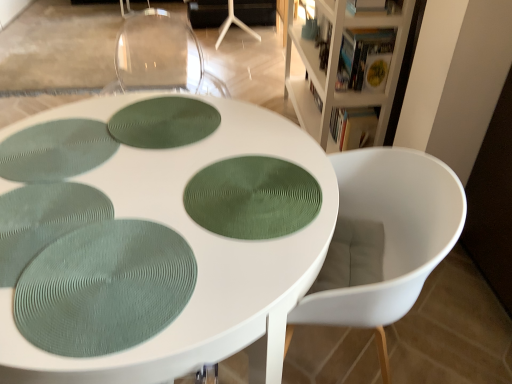
Question: Do you think white wood bookcase at upper right is within green textured placemat at center, positioned as the second oval in top-to-bottom order, or outside of it?

Choices:
 (A) outside
 (B) inside

Answer: (A)

Question: Considering the positions of white wood bookcase at upper right and green textured placemat at center, acting as the second oval starting from the back, in the image, is white wood bookcase at upper right bigger or smaller than green textured placemat at center, acting as the second oval starting from the back,?

Choices:
 (A) small
 (B) big

Answer: (B)

Question: Estimate the real-world distances between objects in this image. Which object is farther from the white matte table at center?

Choices:
 (A) green textured placemat at center, acting as the second oval starting from the back
 (B) white plastic chair at lower right
 (C) green textured placemat at center, the 3th oval from the front
 (D) white wood bookcase at upper right
 (E) green textured placemat at lower left, marked as the 3th oval in a back-to-front arrangement

Answer: (D)

Question: Which object is the farthest from the white plastic chair at lower right?

Choices:
 (A) green textured placemat at center, positioned as the second oval in top-to-bottom order
 (B) green textured placemat at center, which ranks as the first oval in top-to-bottom order
 (C) white matte table at center
 (D) green textured placemat at lower left, the first oval from the bottom
 (E) white wood bookcase at upper right

Answer: (E)